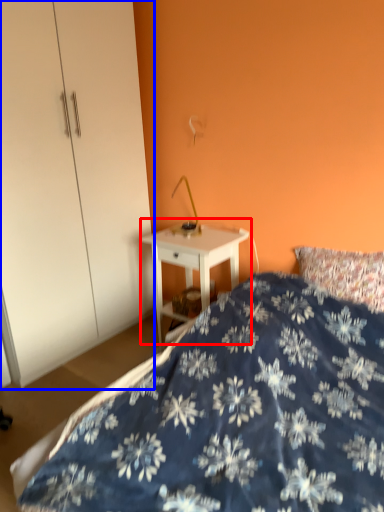
Question: Which object is closer to the camera taking this photo, nightstand (highlighted by a red box) or dresser (highlighted by a blue box)?

Choices:
 (A) nightstand
 (B) dresser

Answer: (B)